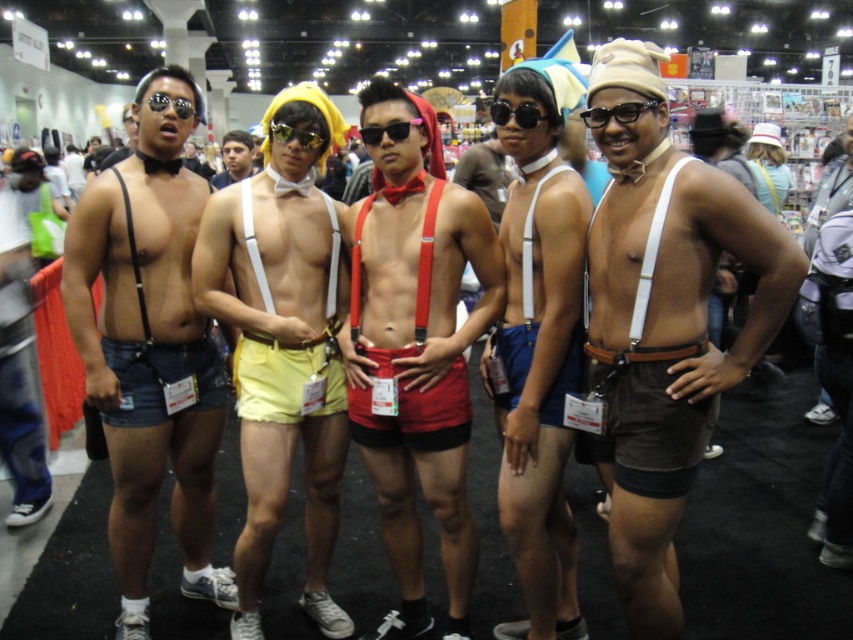
You are a photographer at the event and want to ensure that both the brown suede shorts at center and the matte white suspenders at center are clearly visible in your photo. Given their height, which one might you need to adjust your camera angle for to capture fully?

The brown suede shorts at center is not as tall as matte white suspenders at center, so you might need to adjust your camera angle to ensure the taller matte white suspenders at center is fully captured.